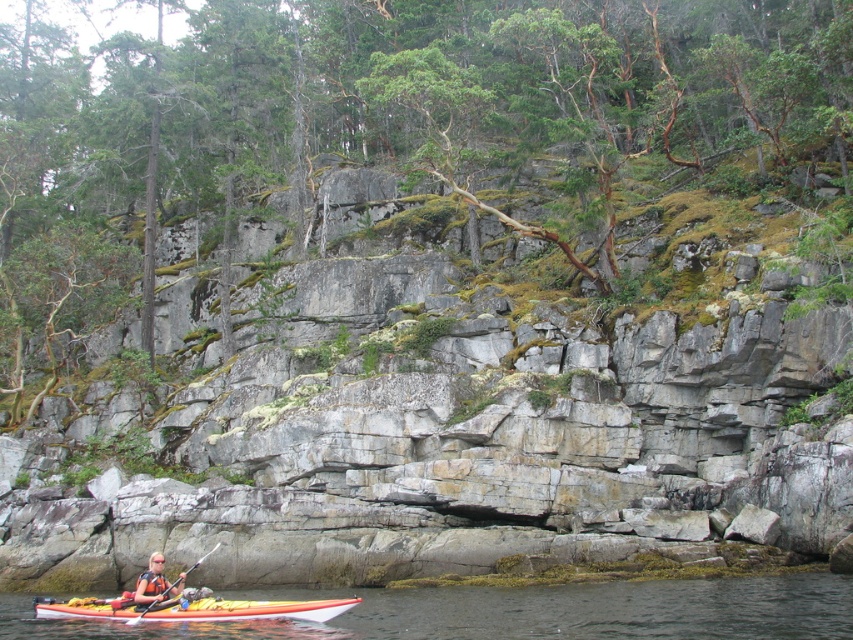
What do you see at coordinates (440, 424) in the screenshot?
I see `gray rock cliff at center` at bounding box center [440, 424].

Which is below, gray rock cliff at center or orange life vest at lower left?

orange life vest at lower left is below.

Is point (583, 560) closer to viewer compared to point (173, 593)?

No, (583, 560) is further to viewer.

Identify the location of gray rock cliff at center. Image resolution: width=853 pixels, height=640 pixels. (440, 424).

Who is more forward, (271, 604) or (180, 573)?

Positioned in front is point (271, 604).

Identify the location of orange kayak at lower center. This screenshot has width=853, height=640. (192, 609).

Can you confirm if gray rock cliff at center is wider than clear water at lower center?

Indeed, gray rock cliff at center has a greater width compared to clear water at lower center.

Which is behind, point (93, 451) or point (677, 596)?

Positioned behind is point (93, 451).

Who is more forward, (288, 445) or (199, 628)?

Point (199, 628) is more forward.

You are a GUI agent. You are given a task and a screenshot of the screen. Output one action in this format:
    pyautogui.click(x=<x>, y=<y>)
    Task: Click on the gray rock cliff at center
    
    Given the screenshot: What is the action you would take?
    pyautogui.click(x=440, y=424)